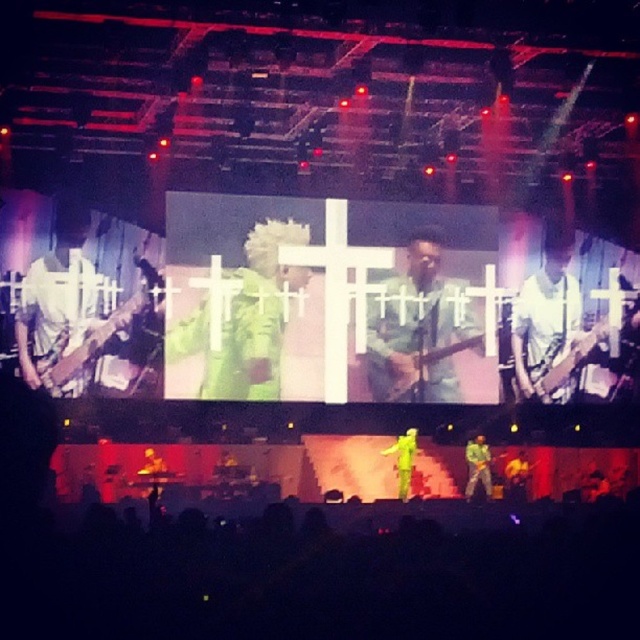
Question: Which object is positioned farthest from the green fabric guitar at lower right?

Choices:
 (A) green matte guitar at center
 (B) green fuzzy coat at center
 (C) green fabric guitar at center

Answer: (B)

Question: Does green matte jacket at center appear on the right side of white matte guitar at left?

Choices:
 (A) no
 (B) yes

Answer: (B)

Question: Among these objects, which one is farthest from the camera?

Choices:
 (A) green fabric guitar at center
 (B) green fabric guitar at lower right
 (C) green fuzzy coat at center

Answer: (A)

Question: Where is green matte jacket at center located in relation to green fabric guitar at lower right in the image?

Choices:
 (A) left
 (B) right

Answer: (A)

Question: Which point is farther from the camera taking this photo?

Choices:
 (A) (396, 456)
 (B) (67, 289)
 (C) (476, 486)
 (D) (208, 323)

Answer: (A)

Question: Can you confirm if green matte jacket at center is positioned to the left of white matte guitar at left?

Choices:
 (A) no
 (B) yes

Answer: (A)